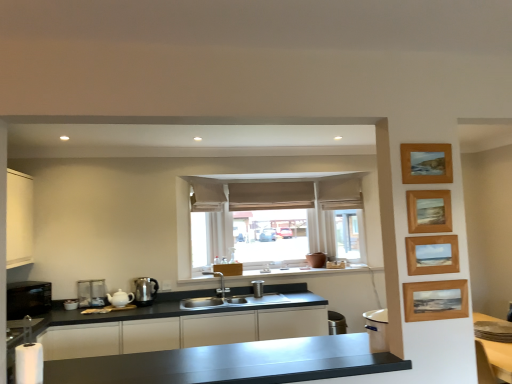
Locate an element on the screen. blank space above beige fabric curtain at upper center, which is the first curtain from right to left (from a real-world perspective) is located at coordinates (339, 179).